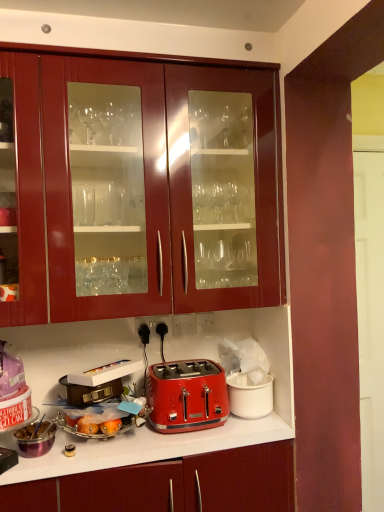
Question: Is red metallic toaster at center at the left side of brown leather suitcase at lower left, the second appliance viewed from the left?

Choices:
 (A) yes
 (B) no

Answer: (B)

Question: Is the depth of red metallic toaster at center greater than that of brown leather suitcase at lower left, the second appliance viewed from the left?

Choices:
 (A) no
 (B) yes

Answer: (A)

Question: Is red metallic toaster at center positioned beyond the bounds of brown leather suitcase at lower left, the second appliance viewed from the left?

Choices:
 (A) yes
 (B) no

Answer: (A)

Question: Does red metallic toaster at center have a greater width compared to brown leather suitcase at lower left, which is the 2th appliance in right-to-left order?

Choices:
 (A) yes
 (B) no

Answer: (A)

Question: Is red metallic toaster at center closer to camera compared to brown leather suitcase at lower left, the second appliance viewed from the left?

Choices:
 (A) yes
 (B) no

Answer: (A)

Question: From the image's perspective, is glossy wood cabinets at upper center located above or below red plastic toaster at center, the 3th appliance viewed from the left?

Choices:
 (A) below
 (B) above

Answer: (B)

Question: Considering the positions of glossy wood cabinets at upper center and red plastic toaster at center, acting as the 1th appliance starting from the right, in the image, is glossy wood cabinets at upper center wider or thinner than red plastic toaster at center, acting as the 1th appliance starting from the right,?

Choices:
 (A) thin
 (B) wide

Answer: (B)

Question: Which is correct: glossy wood cabinets at upper center is inside red plastic toaster at center, the 3th appliance viewed from the left, or outside of it?

Choices:
 (A) outside
 (B) inside

Answer: (A)

Question: Considering the positions of glossy wood cabinets at upper center and red plastic toaster at center, acting as the 1th appliance starting from the right, in the image, is glossy wood cabinets at upper center taller or shorter than red plastic toaster at center, acting as the 1th appliance starting from the right,?

Choices:
 (A) tall
 (B) short

Answer: (A)

Question: Is black plastic electrical outlet at lower center in front of or behind matte red toaster at center in the image?

Choices:
 (A) behind
 (B) front

Answer: (A)

Question: In terms of width, does black plastic electrical outlet at lower center look wider or thinner when compared to matte red toaster at center?

Choices:
 (A) thin
 (B) wide

Answer: (A)

Question: Based on their sizes in the image, would you say black plastic electrical outlet at lower center is bigger or smaller than matte red toaster at center?

Choices:
 (A) small
 (B) big

Answer: (A)

Question: Is black plastic electrical outlet at lower center to the left or to the right of matte red toaster at center in the image?

Choices:
 (A) left
 (B) right

Answer: (B)

Question: Considering the positions of black plastic electrical outlet at lower center and metallic silver toaster at lower left in the image, is black plastic electrical outlet at lower center wider or thinner than metallic silver toaster at lower left?

Choices:
 (A) thin
 (B) wide

Answer: (A)

Question: Is point (167, 321) positioned closer to the camera than point (13, 463)?

Choices:
 (A) closer
 (B) farther

Answer: (B)